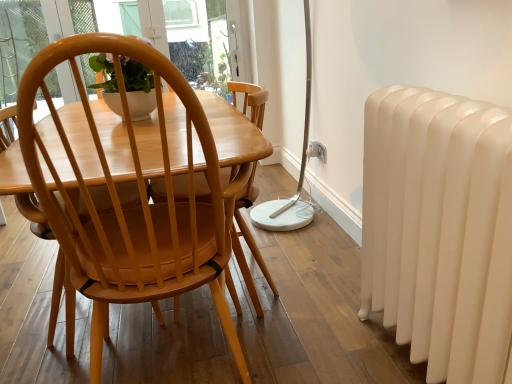
The height and width of the screenshot is (384, 512). Find the location of `vacant space behind matte wood chair at center`. vacant space behind matte wood chair at center is located at coordinates (234, 289).